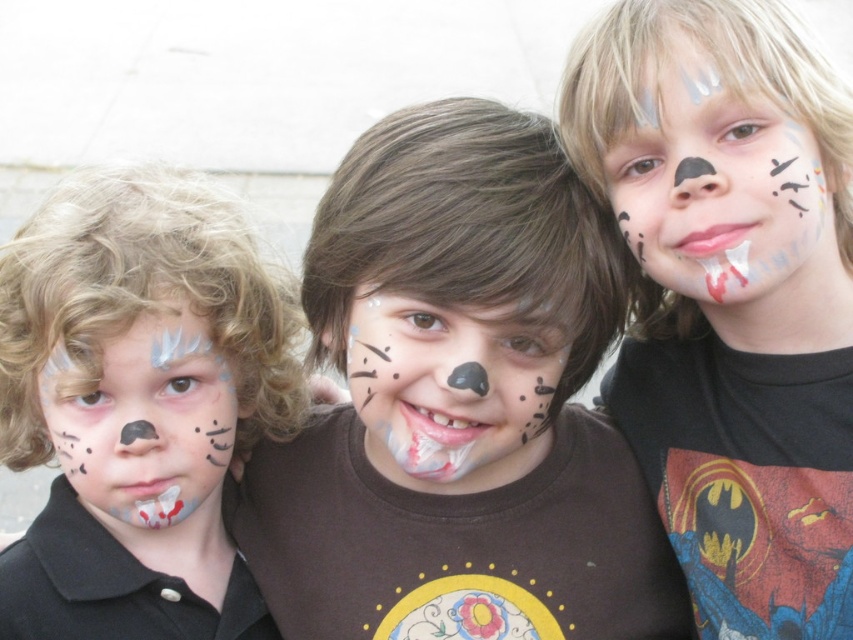
You are a photographer trying to capture a group photo of the three children. You notice two points marked in the image. The first point is at coordinates point (x=664, y=268), and the second point is at point (x=409, y=435). Which of these points is closer to the camera?

Point (x=664, y=268) is in front of point (x=409, y=435), so it is closer to the camera.

You are a makeup artist observing the three children with face paint. The child on the left has curly blonde hair, the middle child has straight brown hair, and the child on the right has light blonde hair. All three have face paint with black spots around the eyes and nose. Which child has the matte black face paint at center positioned at coordinates approximately 0.464 in the x and 0.858 in the y direction?

The matte black face paint at center is located at point (730,296), which corresponds to the middle child with straight brown hair wearing a dark brown T. with a colorful circular design.